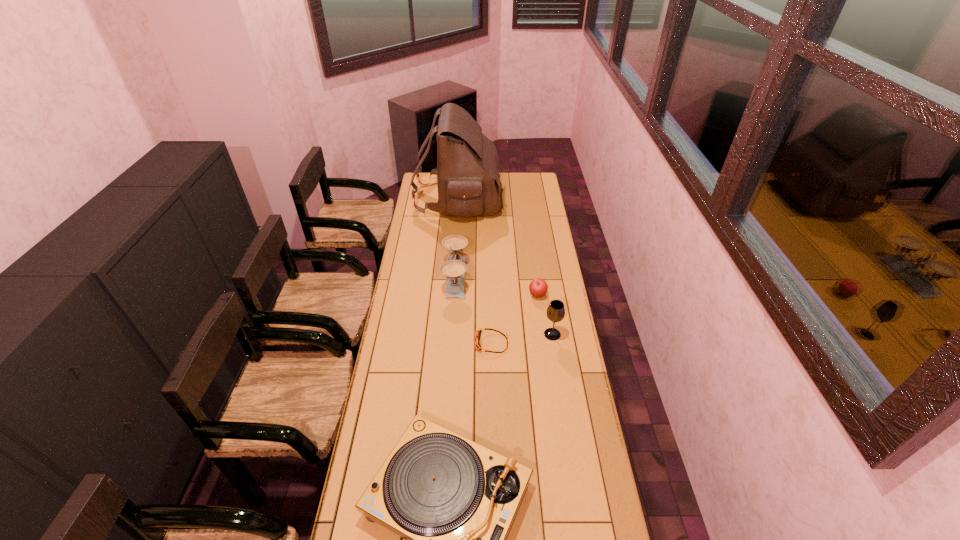
Find the location of `the farthest object`. the farthest object is located at coordinates (467, 170).

I want to click on the tallest object, so click(x=467, y=170).

You are a GUI agent. You are given a task and a screenshot of the screen. Output one action in this format:
    pyautogui.click(x=<x>, y=<y>)
    Task: Click on the scale
    
    Given the screenshot: What is the action you would take?
    pyautogui.click(x=454, y=269)

The height and width of the screenshot is (540, 960). I want to click on wineglass, so pos(555,312).

You are a GUI agent. You are given a task and a screenshot of the screen. Output one action in this format:
    pyautogui.click(x=<x>, y=<y>)
    Task: Click on the fifth tallest object
    
    Given the screenshot: What is the action you would take?
    pyautogui.click(x=538, y=288)

Locate an element on the screen. The image size is (960, 540). the shortest object is located at coordinates (478, 347).

Locate an element on the screen. Image resolution: width=960 pixels, height=540 pixels. free location located on the front flap of the farthest object is located at coordinates (527, 198).

The height and width of the screenshot is (540, 960). What are the coordinates of `vacant space located 0.070m on the front-facing side of the scale` in the screenshot? It's located at (483, 278).

Identify the location of free region located 0.060m on the back of the wineglass. (550, 318).

Where is `free space located on the back of the second shortest object`? free space located on the back of the second shortest object is located at coordinates (534, 265).